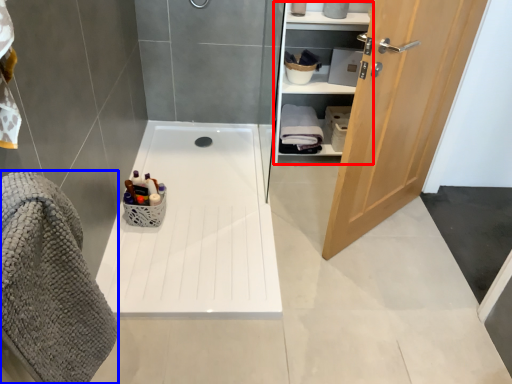
Question: Which object appears closest to the camera in this image, closet (highlighted by a red box) or bath towel (highlighted by a blue box)?

Choices:
 (A) closet
 (B) bath towel

Answer: (B)